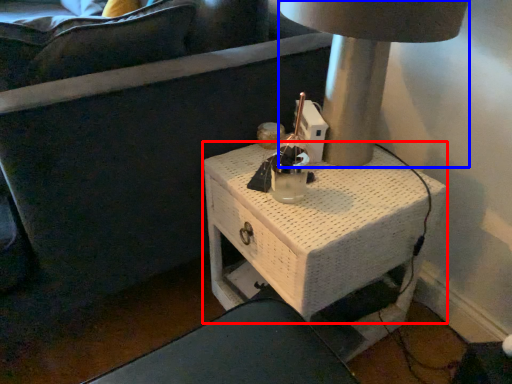
Question: Among these objects, which one is farthest to the camera, table (highlighted by a red box) or table lamp (highlighted by a blue box)?

Choices:
 (A) table
 (B) table lamp

Answer: (A)